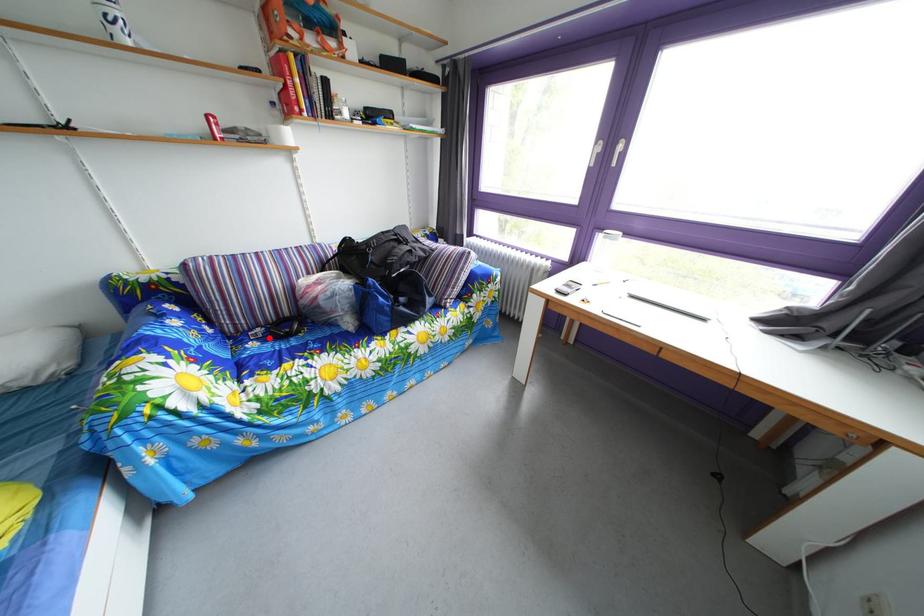
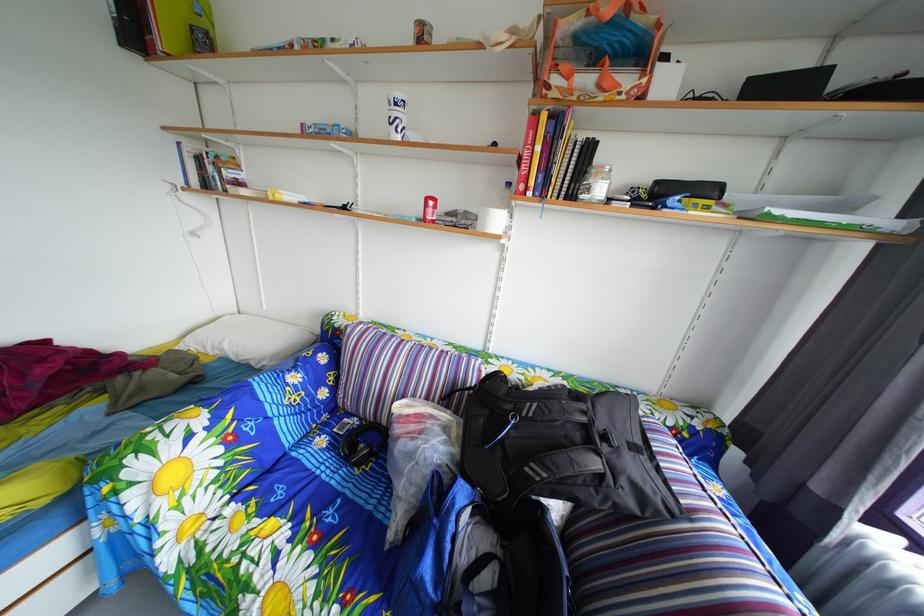
Question: A red point is marked in image1. In image2, is the corresponding 3D point closer to the camera or farther? Reply with the corresponding letter.

Choices:
 (A) The corresponding 3D point is closer.
 (B) The corresponding 3D point is farther.

Answer: (B)